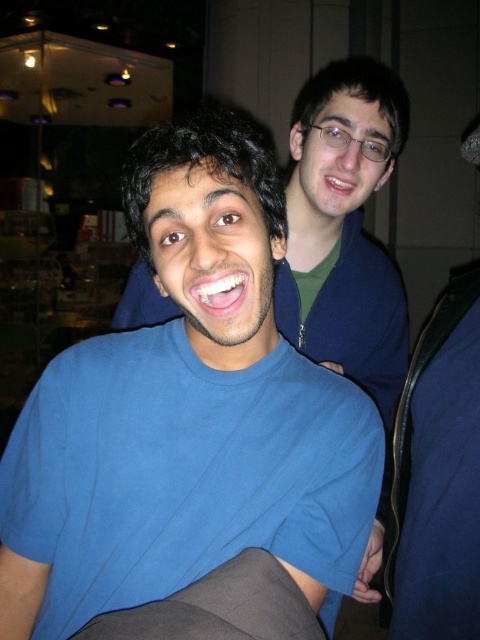
You are organizing a photo album and need to ensure that the blue cotton shirt at center and the matte skin at upper right are placed in order of their sizes. Which object should come first if you arrange them from largest to smallest?

The blue cotton shirt at center is larger in size than the matte skin at upper right, so it should come first in the order from largest to smallest.

You are a photographer adjusting the focus on your camera. You notice two elements in the frame, the white glossy teeth at center and the matte skin at upper right. Which of these elements is shorter in height?

The white glossy teeth at center has a lesser height compared to matte skin at upper right, so the white glossy teeth at center is shorter in height.